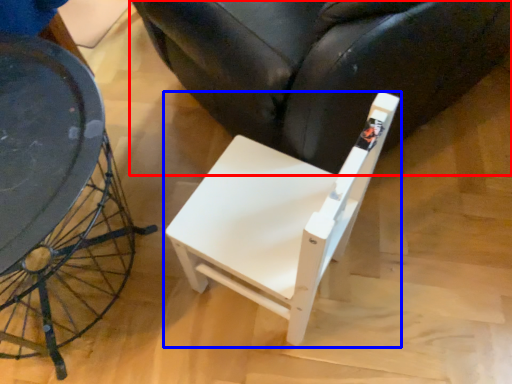
Question: Among these objects, which one is nearest to the camera, chair (highlighted by a red box) or chair (highlighted by a blue box)?

Choices:
 (A) chair
 (B) chair

Answer: (B)